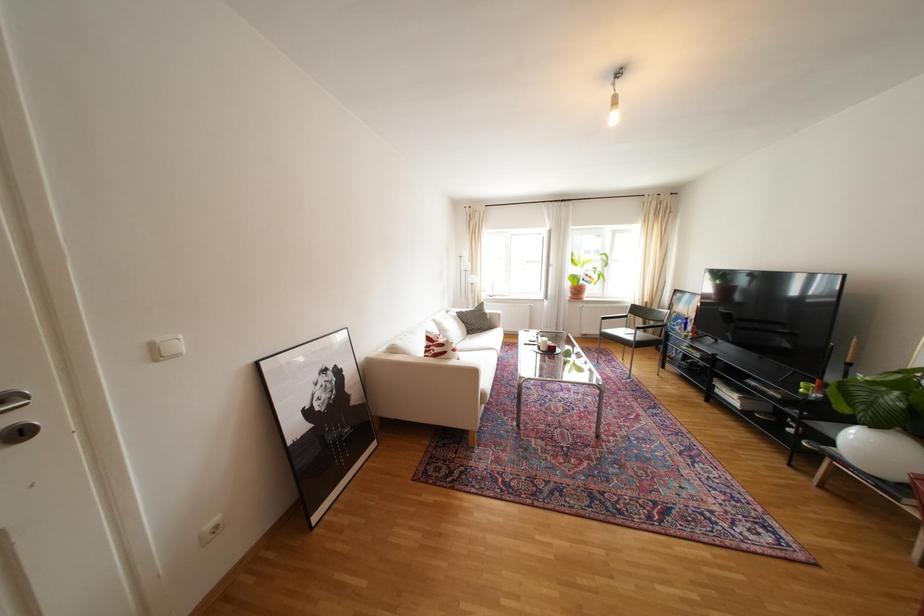
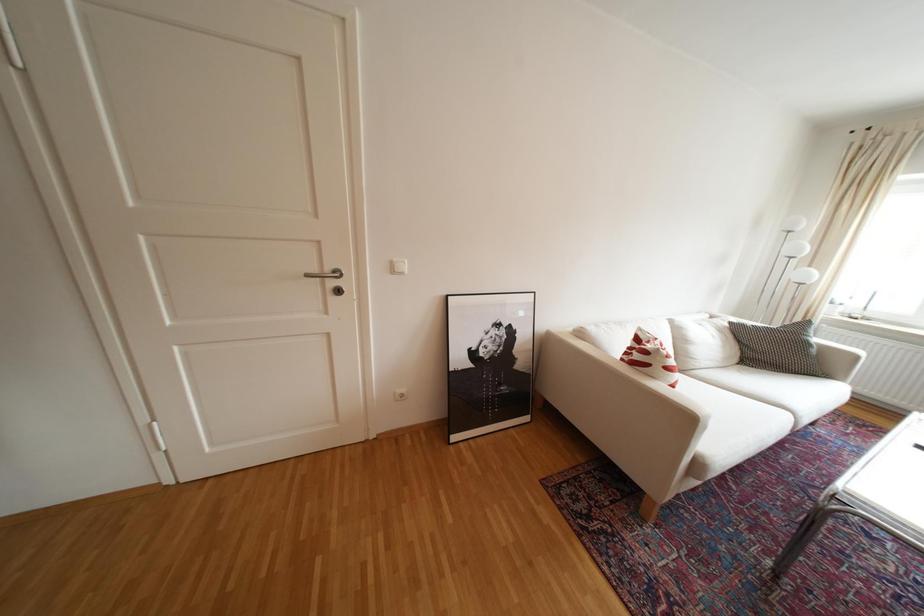
Question: The camera is either moving clockwise (left) or counter-clockwise (right) around the object. The first image is from the beginning of the video and the second image is from the end. Is the camera moving left or right when shooting the video?

Choices:
 (A) Left
 (B) Right

Answer: (B)